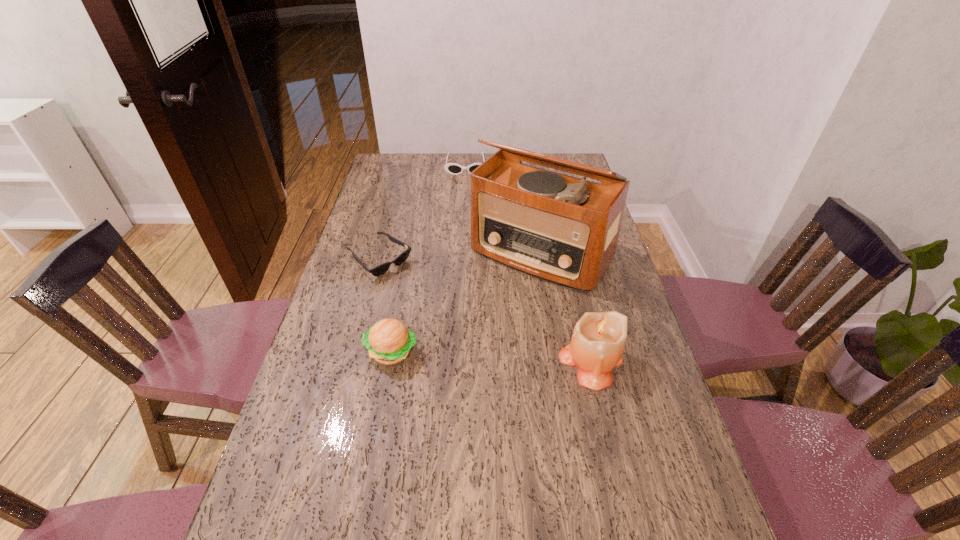
Find the location of a particular element. The image size is (960, 540). candle that is at the right edge is located at coordinates (598, 340).

I want to click on radio receiver located in the right edge section of the desktop, so click(562, 229).

Where is `free region at the far edge of the desktop`? free region at the far edge of the desktop is located at coordinates (492, 153).

In the image, there is a desktop. Identify the location of vacant space at the left edge. The image size is (960, 540). (319, 380).

This screenshot has width=960, height=540. Find the location of `free space at the right edge`. free space at the right edge is located at coordinates (634, 314).

You are a GUI agent. You are given a task and a screenshot of the screen. Output one action in this format:
    pyautogui.click(x=<x>, y=<y>)
    Task: Click on the vacant space at the far left corner of the desktop
    Image resolution: width=960 pixels, height=540 pixels.
    Given the screenshot: What is the action you would take?
    pyautogui.click(x=391, y=165)

Locate an element on the screen. This screenshot has height=540, width=960. free space between the third shortest object and the radio receiver is located at coordinates (467, 302).

Find the location of a particular element. The height and width of the screenshot is (540, 960). vacant area between the radio receiver and the second tallest object is located at coordinates (566, 307).

The height and width of the screenshot is (540, 960). What are the coordinates of `free space between the farther sunglasses and the third tallest object` in the screenshot? It's located at (429, 259).

I want to click on vacant space that's between the nearer sunglasses and the second tallest object, so click(x=486, y=310).